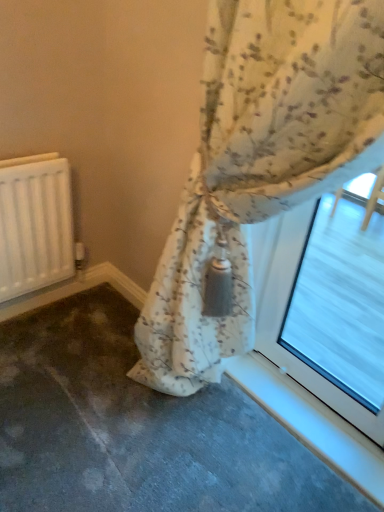
This screenshot has width=384, height=512. What do you see at coordinates (329, 307) in the screenshot?
I see `transparent glass at upper right` at bounding box center [329, 307].

Where is `transparent glass at upper right`? Image resolution: width=384 pixels, height=512 pixels. transparent glass at upper right is located at coordinates (329, 307).

Which is correct: white matte radiator at left is inside transparent glass at upper right, or outside of it?

The correct answer is: outside.

Which is closer, [31,202] or [294,284]?

Clearly, point [31,202] is closer to the camera than point [294,284].

Would you consider white matte radiator at left to be distant from transparent glass at upper right?

Yes, white matte radiator at left and transparent glass at upper right are located far from each other.

Does white matte radiator at left have a greater height compared to transparent glass at upper right?

Incorrect, the height of white matte radiator at left is not larger of that of transparent glass at upper right.

From their relative heights in the image, would you say transparent glass at upper right is taller or shorter than floral fabric curtain at center?

transparent glass at upper right is shorter than floral fabric curtain at center.

Are transparent glass at upper right and floral fabric curtain at center beside each other?

No, transparent glass at upper right is not in contact with floral fabric curtain at center.

Considering the positions of objects transparent glass at upper right and floral fabric curtain at center in the image provided, who is in front, transparent glass at upper right or floral fabric curtain at center?

floral fabric curtain at center is in front.

From the image's perspective, is transparent glass at upper right beneath white matte radiator at left?

Yes.

In the image, is transparent glass at upper right positioned in front of or behind white matte radiator at left?

Visually, transparent glass at upper right is located in front of white matte radiator at left.

Find the location of `bay window on the right of white matte radiator at left`. bay window on the right of white matte radiator at left is located at coordinates (329, 307).

Consider the image. Is transparent glass at upper right positioned with its back to white matte radiator at left?

transparent glass at upper right does not have its back to white matte radiator at left.

Is floral fabric curtain at center to the left or to the right of transparent glass at upper right in the image?

From the image, it's evident that floral fabric curtain at center is to the left of transparent glass at upper right.

Is point (202, 158) farther from camera compared to point (349, 240)?

That is False.

The height and width of the screenshot is (512, 384). Find the location of `curtain in front of the transparent glass at upper right`. curtain in front of the transparent glass at upper right is located at coordinates (260, 161).

What's the angular difference between floral fabric curtain at center and transparent glass at upper right's facing directions?

0.376 degrees.

Which object is positioned more to the right, white matte radiator at left or floral fabric curtain at center?

From the viewer's perspective, floral fabric curtain at center appears more on the right side.

Is white matte radiator at left taller or shorter than floral fabric curtain at center?

Considering their sizes, white matte radiator at left has less height than floral fabric curtain at center.

Is point (53, 193) positioned behind point (296, 21)?

Yes, point (53, 193) is behind point (296, 21).

From the image's perspective, which object appears higher, white matte radiator at left or floral fabric curtain at center?

white matte radiator at left.

Identify the location of radiator behind the floral fabric curtain at center. (35, 224).

Would you say floral fabric curtain at center is inside or outside white matte radiator at left?

floral fabric curtain at center is not enclosed by white matte radiator at left.

In the image, is floral fabric curtain at center positioned in front of or behind white matte radiator at left?

floral fabric curtain at center is in front of white matte radiator at left.

The width and height of the screenshot is (384, 512). In order to click on radiator behind the transparent glass at upper right in this screenshot , I will do `click(35, 224)`.

The width and height of the screenshot is (384, 512). Find the location of `curtain that is above the transparent glass at upper right (from the image's perspective)`. curtain that is above the transparent glass at upper right (from the image's perspective) is located at coordinates (260, 161).

In the scene shown: Looking at the image, which one is located closer to white matte radiator at left, transparent glass at upper right or floral fabric curtain at center?

Based on the image, floral fabric curtain at center appears to be nearer to white matte radiator at left.

From the image, which object appears to be nearer to transparent glass at upper right, white matte radiator at left or floral fabric curtain at center?

The object closer to transparent glass at upper right is floral fabric curtain at center.

Looking at the image, which one is located further to transparent glass at upper right, floral fabric curtain at center or white matte radiator at left?

The object further to transparent glass at upper right is white matte radiator at left.

When comparing their distances from floral fabric curtain at center, does transparent glass at upper right or white matte radiator at left seem further?

The object further to floral fabric curtain at center is white matte radiator at left.

Considering their positions, is white matte radiator at left positioned further to floral fabric curtain at center than transparent glass at upper right?

white matte radiator at left is positioned further to the anchor floral fabric curtain at center.

Based on their spatial positions, is floral fabric curtain at center or transparent glass at upper right further from white matte radiator at left?

Based on the image, transparent glass at upper right appears to be further to white matte radiator at left.

Where is `curtain situated between white matte radiator at left and transparent glass at upper right from left to right`? The width and height of the screenshot is (384, 512). curtain situated between white matte radiator at left and transparent glass at upper right from left to right is located at coordinates (260, 161).